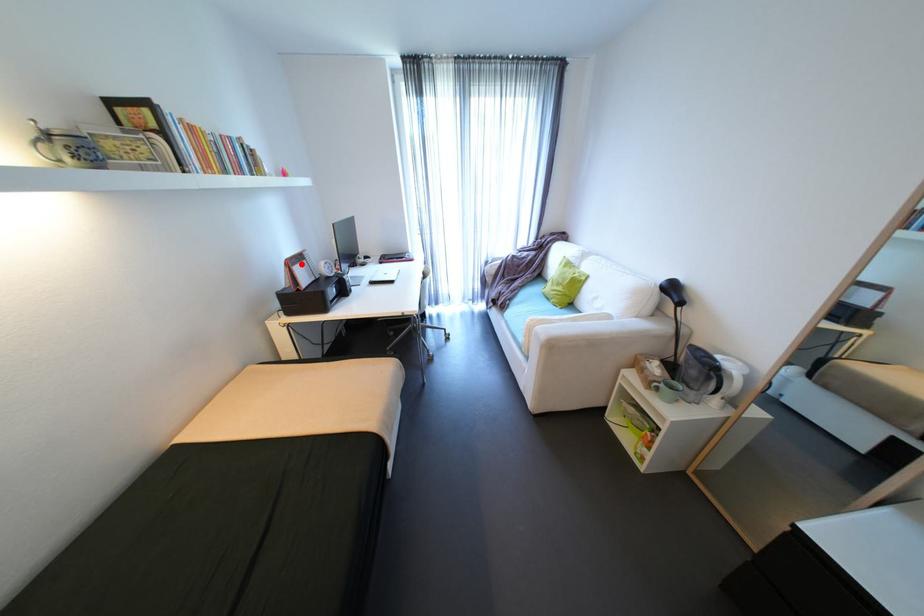
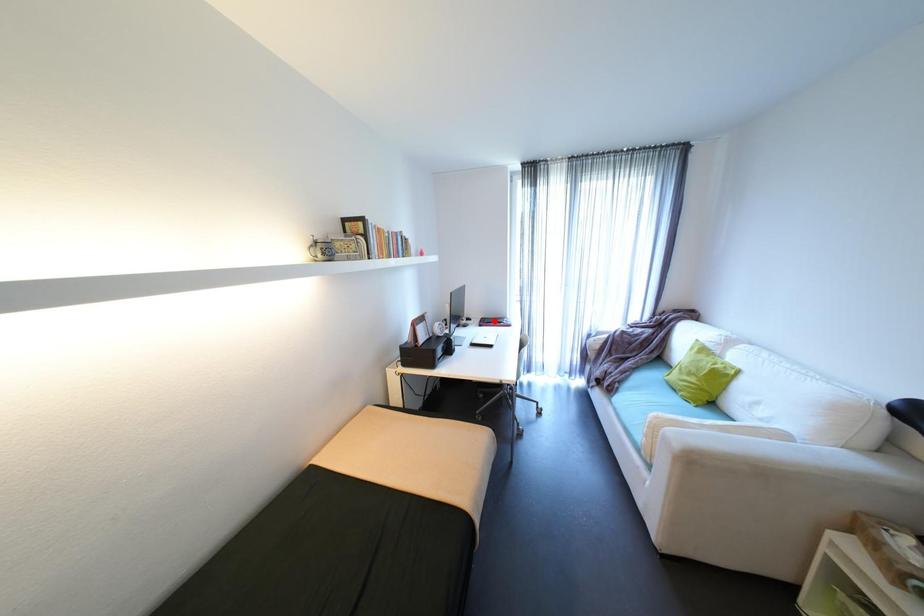
I am providing you with two images of the same scene from different viewpoints. A red point is marked on the first image and another point is marked on the second image. Are the points marked in image1 and image2 representing the same 3D position?

No